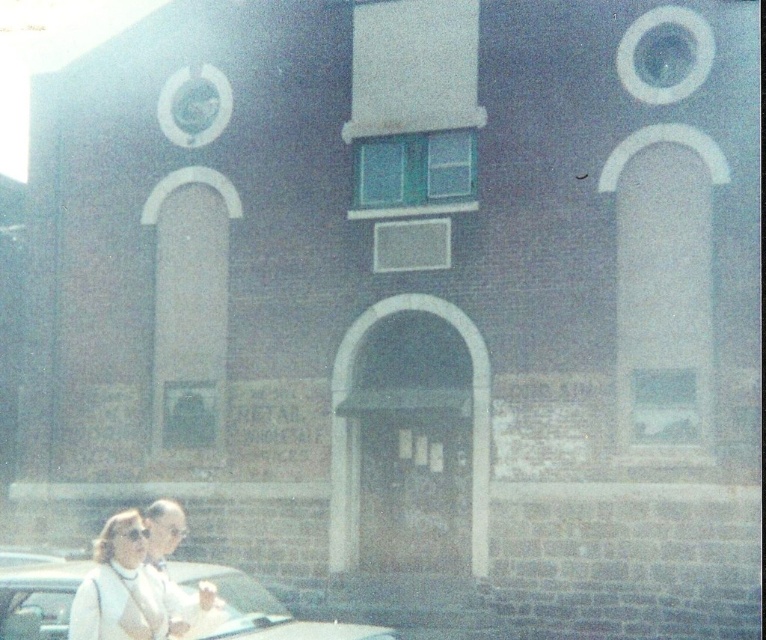
You are standing in front of the building with two large arched windows and a central entrance framed by a white archway. You notice a white matte jacket at lower left. Based on its coordinates, where exactly is the white matte jacket located relative to the building?

The white matte jacket at lower left is located at coordinates point (120, 588) relative to the building.